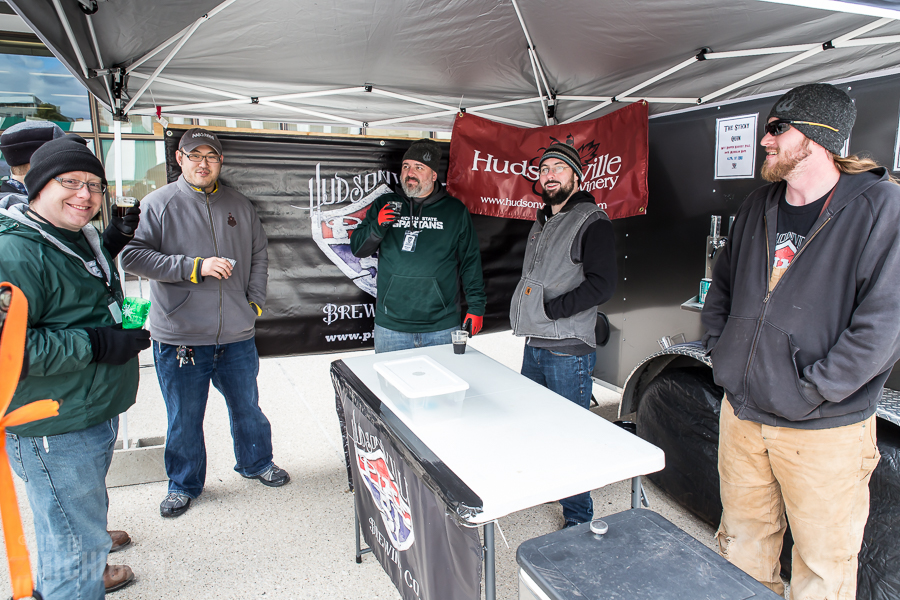
Locate an element on the screen. This screenshot has height=600, width=900. frame is located at coordinates (275, 97).